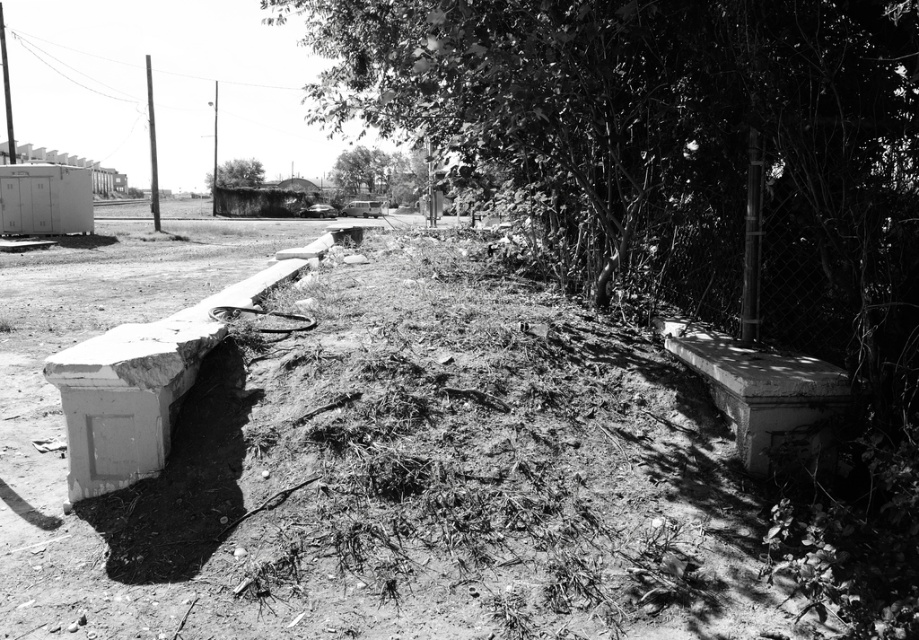
Question: Is smooth bark tree at center thinner than green leafy tree at upper center?

Choices:
 (A) no
 (B) yes

Answer: (A)

Question: Which is farther from the dirt field at center?

Choices:
 (A) smooth green tree at upper center
 (B) smooth bark tree at center

Answer: (A)

Question: Is smooth bark tree at center further to the viewer compared to green leafy tree at upper center?

Choices:
 (A) no
 (B) yes

Answer: (A)

Question: Which of these objects is positioned closest to the smooth green tree at upper center?

Choices:
 (A) dirt field at center
 (B) smooth bark tree at center
 (C) green leafy tree at upper center

Answer: (C)

Question: Which object is farther from the camera taking this photo?

Choices:
 (A) dirt field at center
 (B) green leafy tree at upper center

Answer: (B)

Question: Can you confirm if smooth bark tree at center is smaller than smooth green tree at upper center?

Choices:
 (A) no
 (B) yes

Answer: (A)